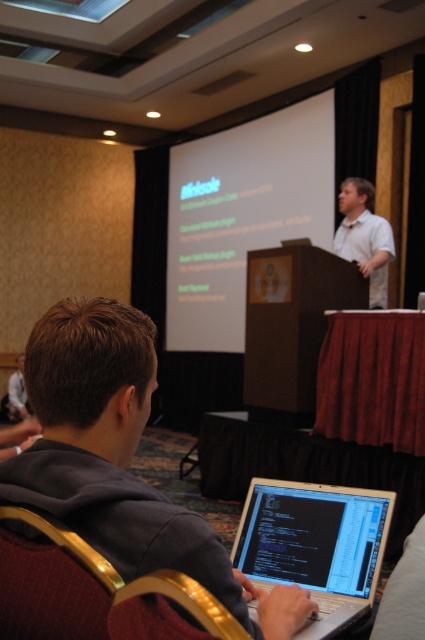
Between white matte projection screen at upper center and silver metallic laptop at center, which one is positioned lower?

silver metallic laptop at center is lower down.

Does point (204, 241) lie behind point (328, 596)?

Yes, it is behind point (328, 596).

The image size is (425, 640). Find the location of `white matte projection screen at upper center`. white matte projection screen at upper center is located at coordinates (243, 214).

You are a GUI agent. You are given a task and a screenshot of the screen. Output one action in this format:
    pyautogui.click(x=<x>, y=<y>)
    Task: Click on the gray hoodie at lower left
    Image resolution: width=425 pixels, height=640 pixels.
    Given the screenshot: What is the action you would take?
    pyautogui.click(x=119, y=460)

Can you confirm if gray hoodie at lower left is thinner than silver metallic laptop at center?

No.

Describe the element at coordinates (119, 460) in the screenshot. I see `gray hoodie at lower left` at that location.

Where is `gray hoodie at lower left`? gray hoodie at lower left is located at coordinates (119, 460).

Which of these two, white matte projection screen at upper center or white shirt at center, stands shorter?

white shirt at center is shorter.

Who is lower down, white matte projection screen at upper center or white shirt at center?

white shirt at center is below.

Is point (268, 221) positioned before point (384, 228)?

No.

Where is `white matte projection screen at upper center`? The image size is (425, 640). white matte projection screen at upper center is located at coordinates (243, 214).